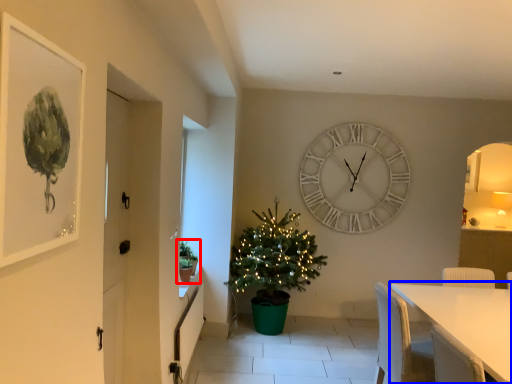
Question: Among these objects, which one is farthest to the camera, houseplant (highlighted by a red box) or table (highlighted by a blue box)?

Choices:
 (A) houseplant
 (B) table

Answer: (A)